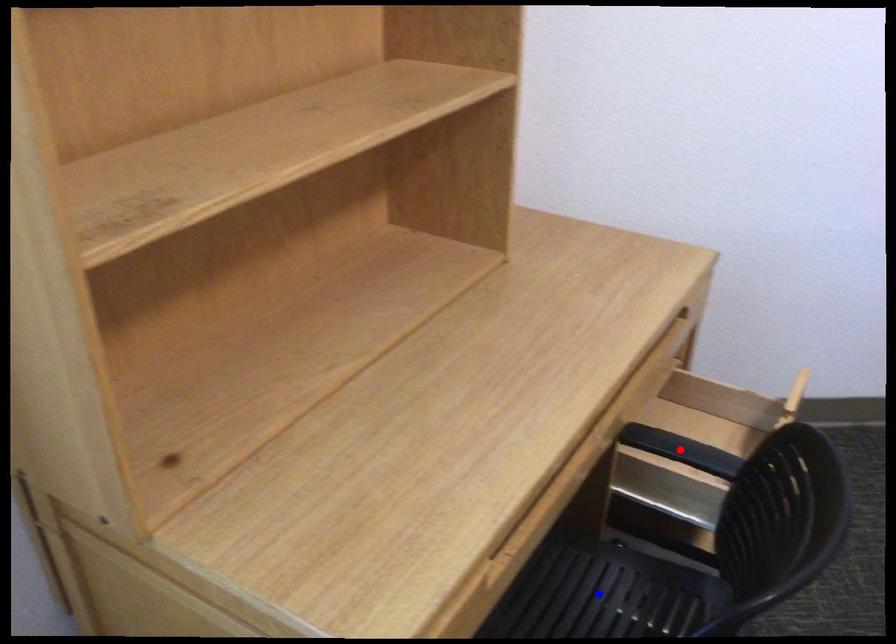
Question: Which of the two points in the image is closer to the camera?

Choices:
 (A) Blue point is closer.
 (B) Red point is closer.

Answer: (A)